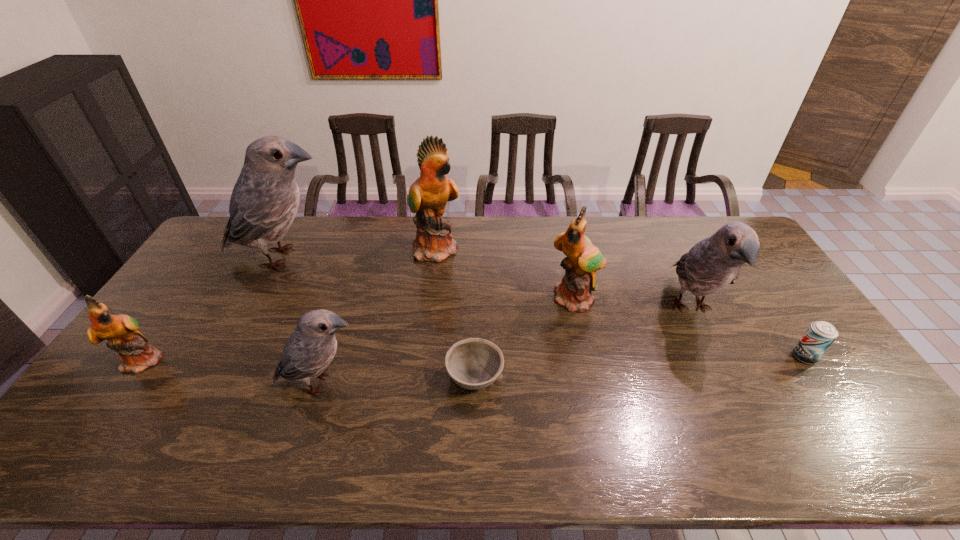
Locate an element on the screen. vacant region located 0.260m on the front of the rightmost object is located at coordinates (873, 457).

Where is `blank space located on the right of the gray bowl`? blank space located on the right of the gray bowl is located at coordinates (622, 377).

Where is `object that is positioned at the right edge`? object that is positioned at the right edge is located at coordinates [820, 335].

Find the location of a particular element. This screenshot has height=540, width=960. object located in the far left corner section of the desktop is located at coordinates [265, 199].

Image resolution: width=960 pixels, height=540 pixels. I want to click on vacant space at the far edge of the desktop, so click(x=494, y=238).

Image resolution: width=960 pixels, height=540 pixels. In order to click on vacant space at the near edge of the desktop in this screenshot , I will do `click(517, 443)`.

You are a GUI agent. You are given a task and a screenshot of the screen. Output one action in this format:
    pyautogui.click(x=<x>, y=<y>)
    Task: Click on the vacant space at the left edge of the desktop
    
    Given the screenshot: What is the action you would take?
    pyautogui.click(x=152, y=321)

This screenshot has width=960, height=540. In the image, there is a desktop. Identify the location of vacant space at the far right corner. (715, 226).

What are the coordinates of `free area in between the farthest gray parrot and the seventh tallest object` in the screenshot? It's located at coord(544,307).

Where is `free point between the nearest gray parrot and the gray bowl`? This screenshot has width=960, height=540. free point between the nearest gray parrot and the gray bowl is located at coordinates (398, 381).